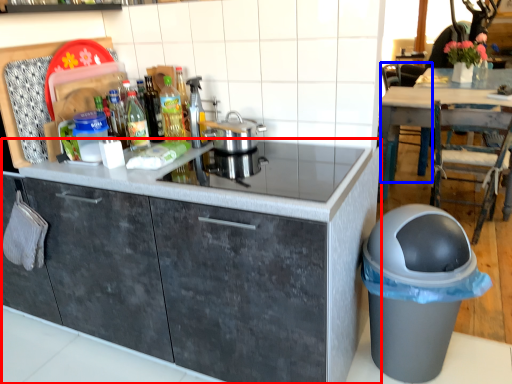
Question: Among these objects, which one is farthest to the camera, cabinetry (highlighted by a red box) or chair (highlighted by a blue box)?

Choices:
 (A) cabinetry
 (B) chair

Answer: (B)